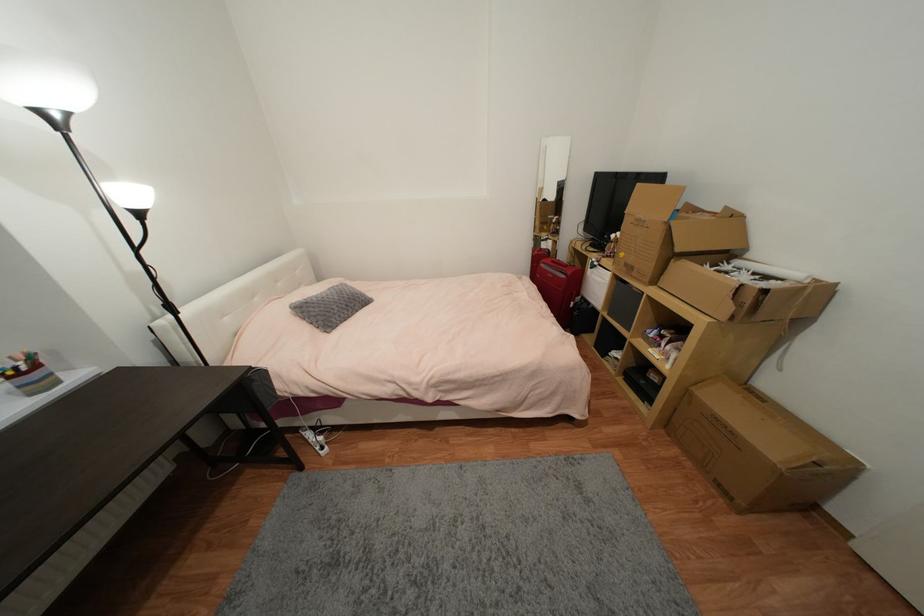
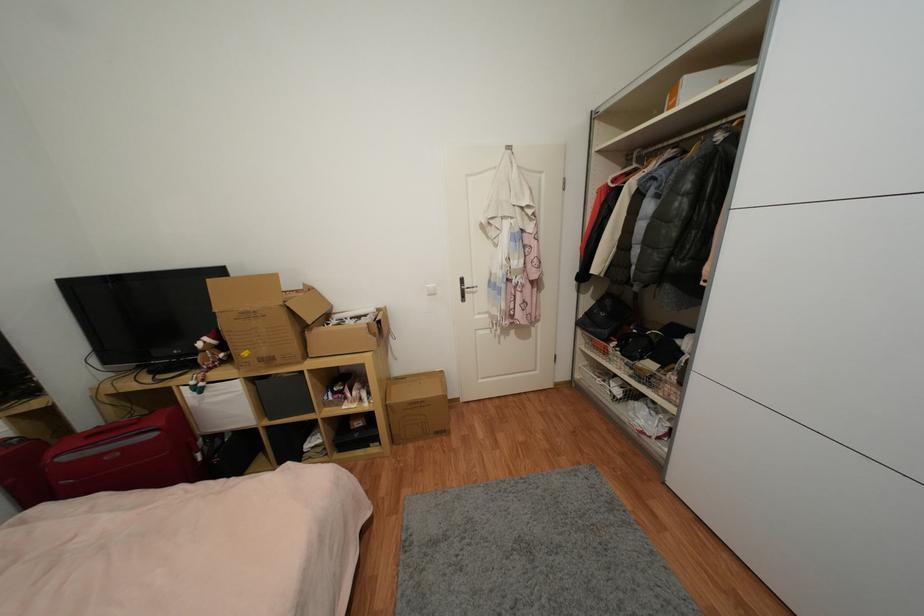
Find the pixel in the second image that matches point 634,270 in the first image.

(274, 361)